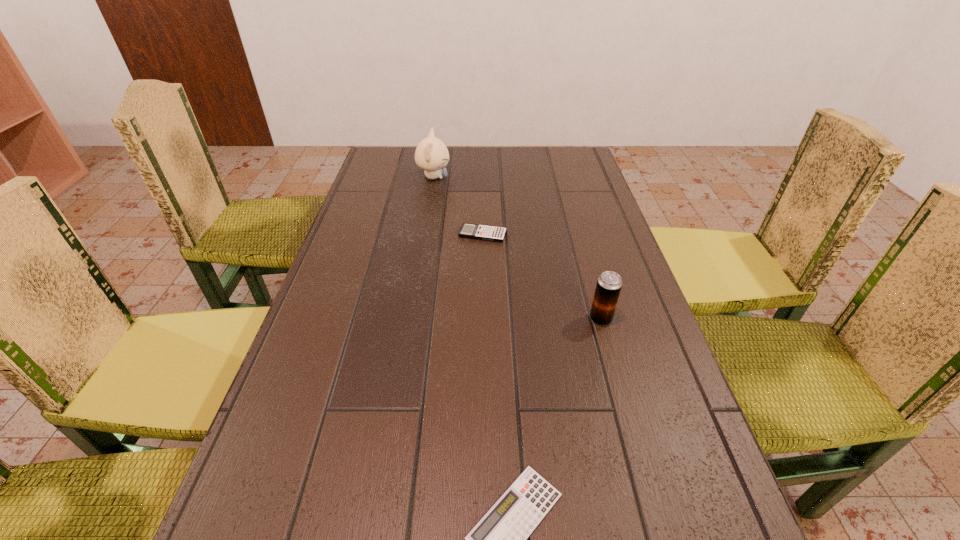
Image resolution: width=960 pixels, height=540 pixels. I want to click on the farthest object, so click(431, 155).

Where is `kitten`? The width and height of the screenshot is (960, 540). kitten is located at coordinates (431, 155).

At what (x,y) coordinates should I click in order to perform the action: click on the second nearest object. Please return your answer as a coordinate pair (x, y). Looking at the image, I should click on (609, 284).

Locate an element on the screen. The height and width of the screenshot is (540, 960). beer can is located at coordinates (609, 284).

This screenshot has width=960, height=540. I want to click on the second farthest object, so click(x=473, y=231).

What are the coordinates of `the third tallest object` in the screenshot? It's located at (473, 231).

This screenshot has width=960, height=540. I want to click on free region located on the face of the kitten, so click(x=502, y=177).

The image size is (960, 540). I want to click on vacant space positioned on the left of the third farthest object, so click(508, 319).

Where is `vacant space located on the right of the farther calculator`? vacant space located on the right of the farther calculator is located at coordinates (594, 234).

Locate an element on the screen. The width and height of the screenshot is (960, 540). object located in the far edge section of the desktop is located at coordinates (431, 155).